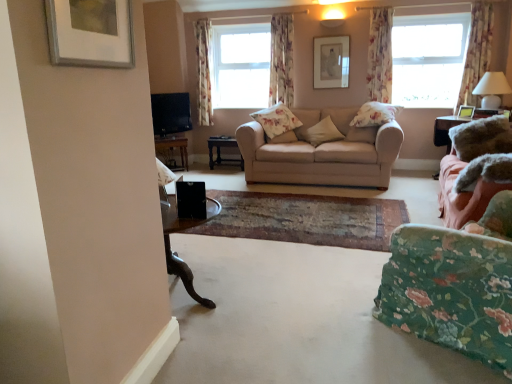
Question: Can you confirm if floral fabric curtain at upper right, acting as the 3th curtain starting from the left, is smaller than beige fabric pillow at center, placed as the 3th pillow when sorted from back to front?

Choices:
 (A) yes
 (B) no

Answer: (A)

Question: Is the position of floral fabric curtain at upper right, the 2th curtain when ordered from right to left, more distant than that of beige fabric pillow at center, placed as the 3th pillow when sorted from back to front?

Choices:
 (A) yes
 (B) no

Answer: (A)

Question: Is floral fabric curtain at upper right, acting as the 3th curtain starting from the left, touching beige fabric pillow at center, the third pillow in the front-to-back sequence?

Choices:
 (A) no
 (B) yes

Answer: (A)

Question: Could beige fabric pillow at center, the third pillow in the front-to-back sequence, be considered to be inside floral fabric curtain at upper right, acting as the 3th curtain starting from the left?

Choices:
 (A) no
 (B) yes

Answer: (A)

Question: From a real-world perspective, is floral fabric curtain at upper right, acting as the 3th curtain starting from the left, physically below beige fabric pillow at center, the third pillow in the front-to-back sequence?

Choices:
 (A) yes
 (B) no

Answer: (B)

Question: Is floral fabric curtain at upper right, acting as the 3th curtain starting from the left, facing towards beige fabric pillow at center, placed as the 3th pillow when sorted from back to front?

Choices:
 (A) yes
 (B) no

Answer: (B)

Question: Are dark wood table at center, the second table from the left, and floral fabric curtain at upper right, acting as the 3th curtain starting from the left, beside each other?

Choices:
 (A) yes
 (B) no

Answer: (B)

Question: Can you confirm if dark wood table at center, which is the first table from right to left, is thinner than floral fabric curtain at upper right, the 2th curtain when ordered from right to left?

Choices:
 (A) yes
 (B) no

Answer: (B)

Question: Is dark wood table at center, the second table from the left, turned away from floral fabric curtain at upper right, acting as the 3th curtain starting from the left?

Choices:
 (A) yes
 (B) no

Answer: (B)

Question: From the image's perspective, is dark wood table at center, the second table from the left, located above floral fabric curtain at upper right, the 2th curtain when ordered from right to left?

Choices:
 (A) yes
 (B) no

Answer: (B)

Question: Can you confirm if dark wood table at center, the second table from the left, is wider than floral fabric curtain at upper right, the 2th curtain when ordered from right to left?

Choices:
 (A) yes
 (B) no

Answer: (A)

Question: From a real-world perspective, is dark wood table at center, which is the first table from right to left, under floral fabric curtain at upper right, acting as the 3th curtain starting from the left?

Choices:
 (A) yes
 (B) no

Answer: (A)

Question: From a real-world perspective, is white glossy lampshade at right over floral fabric curtain at upper center, which is the 1th curtain from left to right?

Choices:
 (A) yes
 (B) no

Answer: (B)